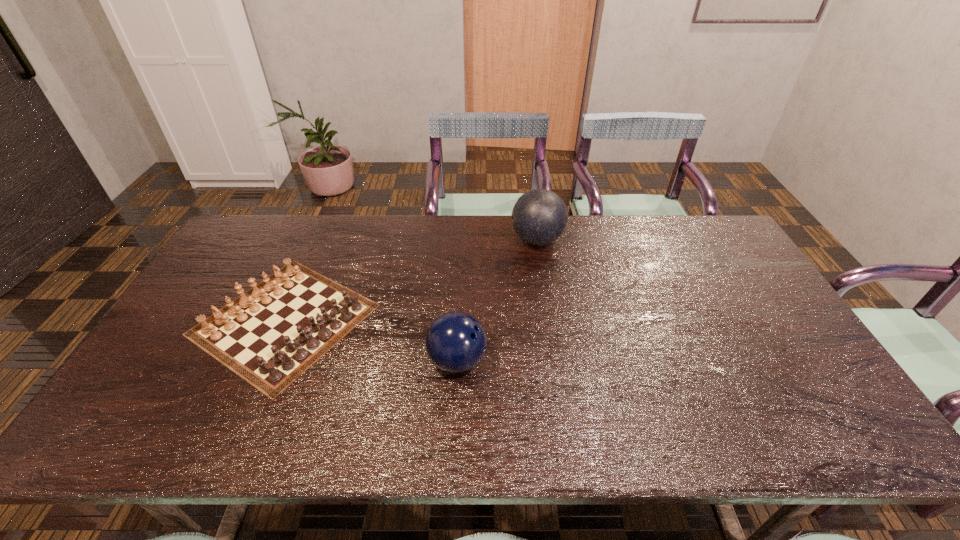
Locate an element on the screen. free region located 0.360m on the right of the chessboard is located at coordinates (504, 319).

This screenshot has width=960, height=540. Find the location of `object present at the far edge`. object present at the far edge is located at coordinates (539, 217).

Identify the location of object present at the left edge. The width and height of the screenshot is (960, 540). (269, 338).

The height and width of the screenshot is (540, 960). I want to click on vacant space at the far edge of the desktop, so click(398, 243).

In the image, there is a desktop. At what (x,y) coordinates should I click in order to perform the action: click on free space at the near edge. Please return your answer as a coordinate pair (x, y). The height and width of the screenshot is (540, 960). Looking at the image, I should click on 178,438.

Locate an element on the screen. free region at the left edge of the desktop is located at coordinates (135, 375).

The width and height of the screenshot is (960, 540). Identify the location of free spot at the right edge of the desktop. (709, 285).

Where is `vacant space at the far right corner`? This screenshot has height=540, width=960. vacant space at the far right corner is located at coordinates (691, 249).

Locate an element on the screen. Image resolution: width=960 pixels, height=540 pixels. vacant space that's between the taller bowling ball and the chessboard is located at coordinates (411, 279).

What are the coordinates of `vacant point located between the nearer bowling ball and the right bowling ball` in the screenshot? It's located at pos(497,300).